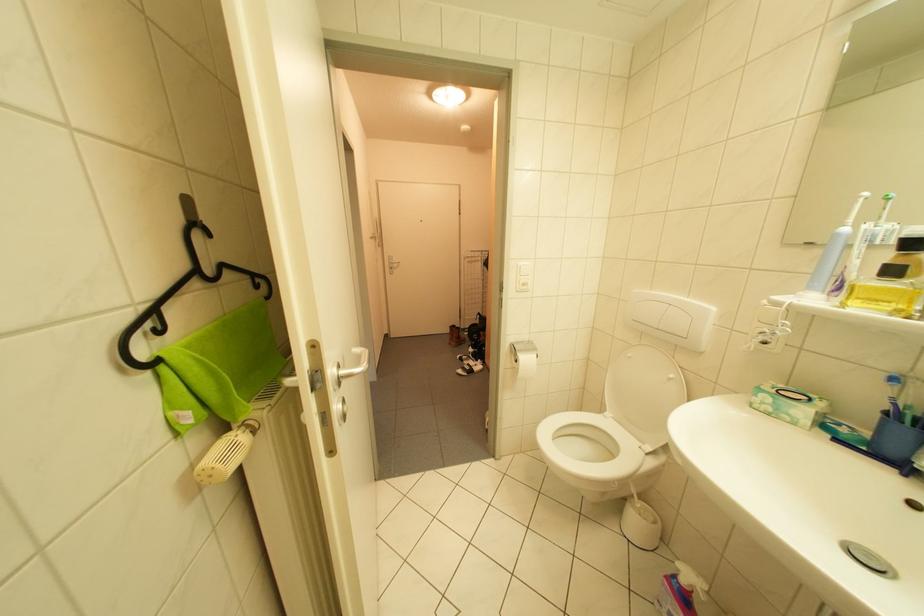
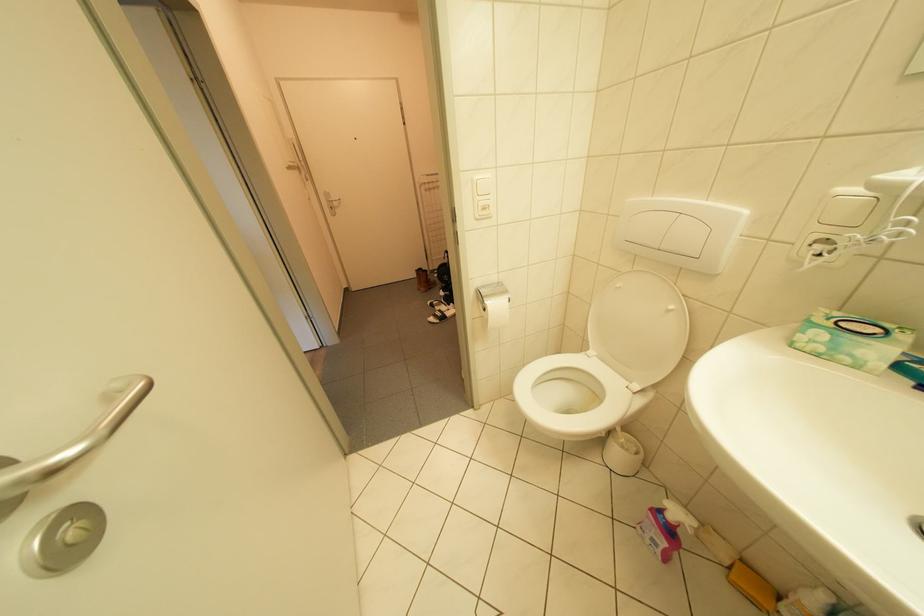
The images are taken continuously from a first-person perspective. In which direction are you moving?

The cameraman moved toward right, forward.